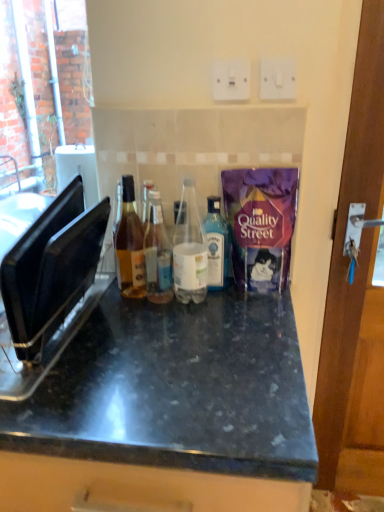
Locate an element on the screen. Image resolution: width=384 pixels, height=512 pixels. free location to the right of translucent plastic bottle at center, the 2th bottle from the right is located at coordinates (256, 305).